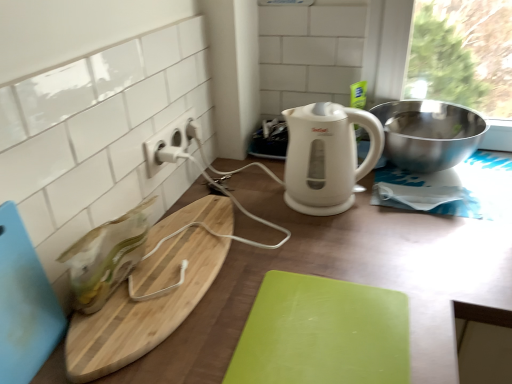
Question: Is white plastic electric outlet at upper center to the right of green matte cutting board at center, marked as the first cutting board in a right-to-left arrangement, from the viewer's perspective?

Choices:
 (A) no
 (B) yes

Answer: (A)

Question: Is white plastic electric outlet at upper center positioned with its back to green matte cutting board at center, marked as the first cutting board in a right-to-left arrangement?

Choices:
 (A) no
 (B) yes

Answer: (A)

Question: Is white plastic electric outlet at upper center next to green matte cutting board at center, marked as the first cutting board in a right-to-left arrangement, and touching it?

Choices:
 (A) yes
 (B) no

Answer: (B)

Question: From a real-world perspective, does white plastic electric outlet at upper center stand above green matte cutting board at center, arranged as the 3th cutting board when viewed from the left?

Choices:
 (A) yes
 (B) no

Answer: (A)

Question: Can you confirm if white plastic electric outlet at upper center is bigger than green matte cutting board at center, arranged as the 3th cutting board when viewed from the left?

Choices:
 (A) yes
 (B) no

Answer: (B)

Question: In the image, is white glossy electric kettle at center positioned in front of or behind white plastic electric outlet at upper center?

Choices:
 (A) front
 (B) behind

Answer: (A)

Question: Would you say white glossy electric kettle at center is to the left or to the right of white plastic electric outlet at upper center in the picture?

Choices:
 (A) left
 (B) right

Answer: (B)

Question: From a real-world perspective, is white glossy electric kettle at center positioned above or below white plastic electric outlet at upper center?

Choices:
 (A) above
 (B) below

Answer: (B)

Question: Is point (323, 185) positioned closer to the camera than point (158, 150)?

Choices:
 (A) closer
 (B) farther

Answer: (B)

Question: Is point (186, 220) closer or farther from the camera than point (157, 145)?

Choices:
 (A) farther
 (B) closer

Answer: (A)

Question: Is natural wood cutting board at left, which is the 2th cutting board from left to right, spatially inside white plastic electric outlet at upper center, or outside of it?

Choices:
 (A) outside
 (B) inside

Answer: (A)

Question: Is natural wood cutting board at left, which is the 2th cutting board from left to right, bigger or smaller than white plastic electric outlet at upper center?

Choices:
 (A) small
 (B) big

Answer: (B)

Question: From a real-world perspective, is natural wood cutting board at left, the second cutting board when ordered from right to left, above or below white plastic electric outlet at upper center?

Choices:
 (A) above
 (B) below

Answer: (B)

Question: Relative to polished stainless steel bowl at upper right, is green matte cutting board at center, arranged as the 3th cutting board when viewed from the left, in front or behind?

Choices:
 (A) behind
 (B) front

Answer: (B)

Question: Considering the positions of green matte cutting board at center, marked as the first cutting board in a right-to-left arrangement, and polished stainless steel bowl at upper right in the image, is green matte cutting board at center, marked as the first cutting board in a right-to-left arrangement, taller or shorter than polished stainless steel bowl at upper right?

Choices:
 (A) tall
 (B) short

Answer: (B)